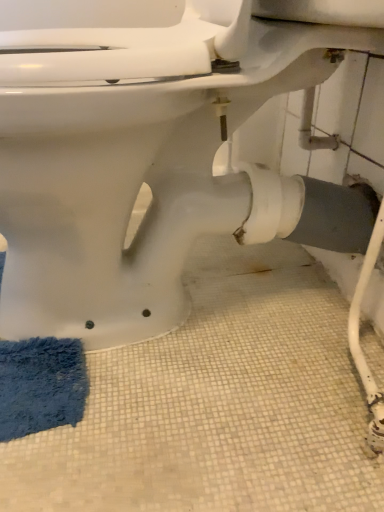
Question: In the image, is white glossy toilet at center positioned in front of or behind blue fuzzy bath mat at lower left?

Choices:
 (A) behind
 (B) front

Answer: (B)

Question: Considering the positions of point [205, 181] and point [19, 364], is point [205, 181] closer or farther from the camera than point [19, 364]?

Choices:
 (A) farther
 (B) closer

Answer: (A)

Question: Would you say white glossy toilet at center is to the left or to the right of blue fuzzy bath mat at lower left in the picture?

Choices:
 (A) left
 (B) right

Answer: (B)

Question: Is point (28, 371) positioned closer to the camera than point (180, 27)?

Choices:
 (A) farther
 (B) closer

Answer: (A)

Question: Is blue fuzzy bath mat at lower left wider or thinner than white glossy toilet at center?

Choices:
 (A) wide
 (B) thin

Answer: (B)

Question: Is blue fuzzy bath mat at lower left taller or shorter than white glossy toilet at center?

Choices:
 (A) short
 (B) tall

Answer: (A)

Question: Is blue fuzzy bath mat at lower left inside or outside of white glossy toilet at center?

Choices:
 (A) inside
 (B) outside

Answer: (A)